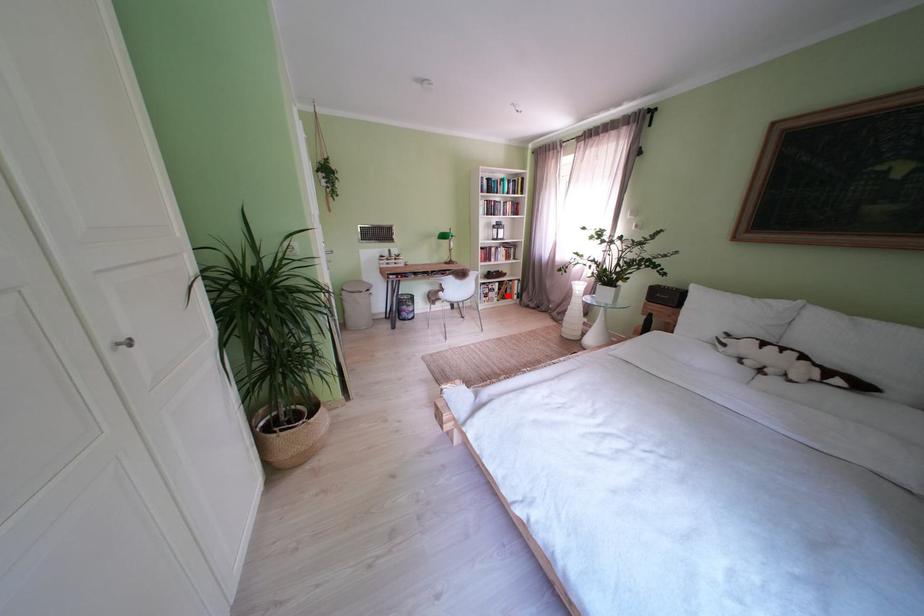
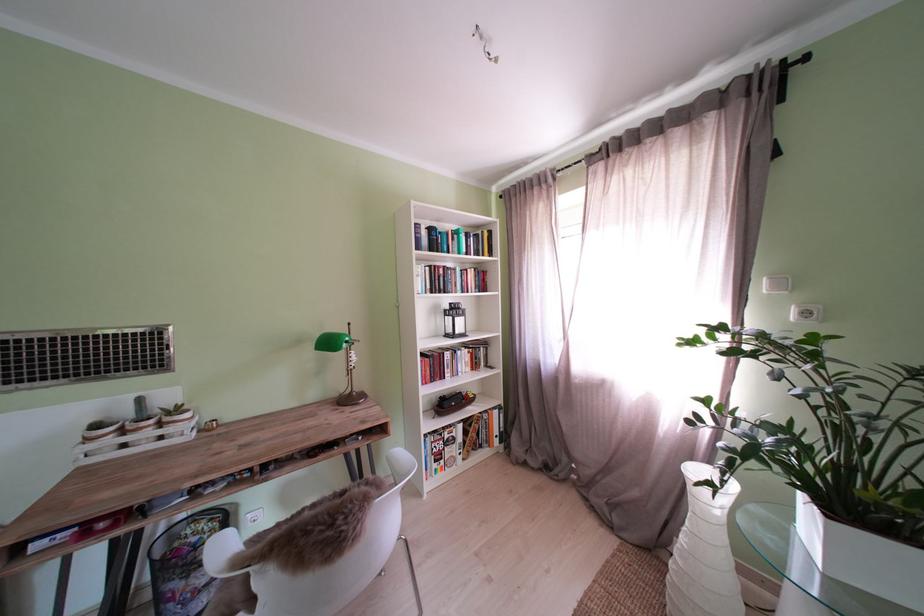
Question: I am providing you with two images of the same scene from different viewpoints. In image1, a red point is highlighted. Considering the same 3D point in image2, which of the following is correct?

Choices:
 (A) It is closer
 (B) It is farther

Answer: (B)